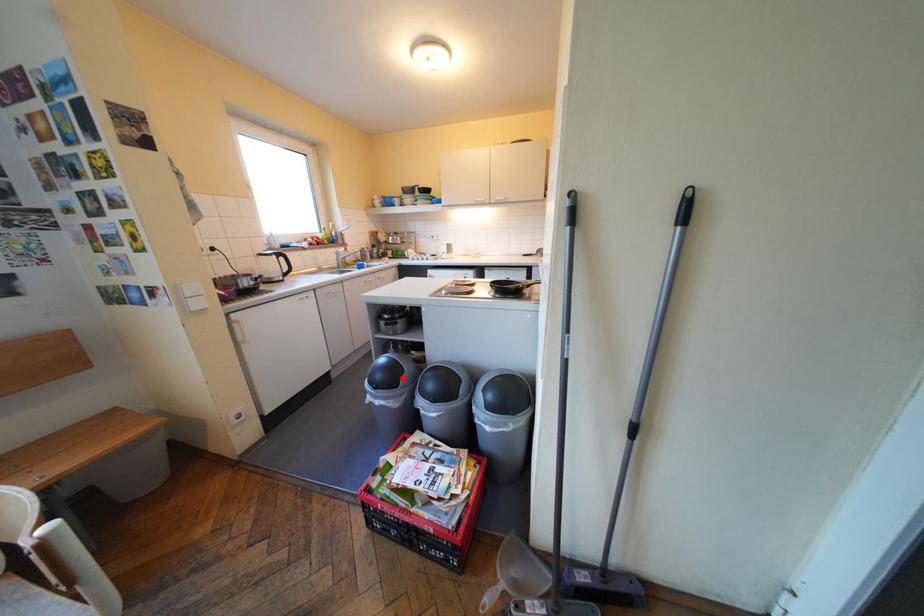
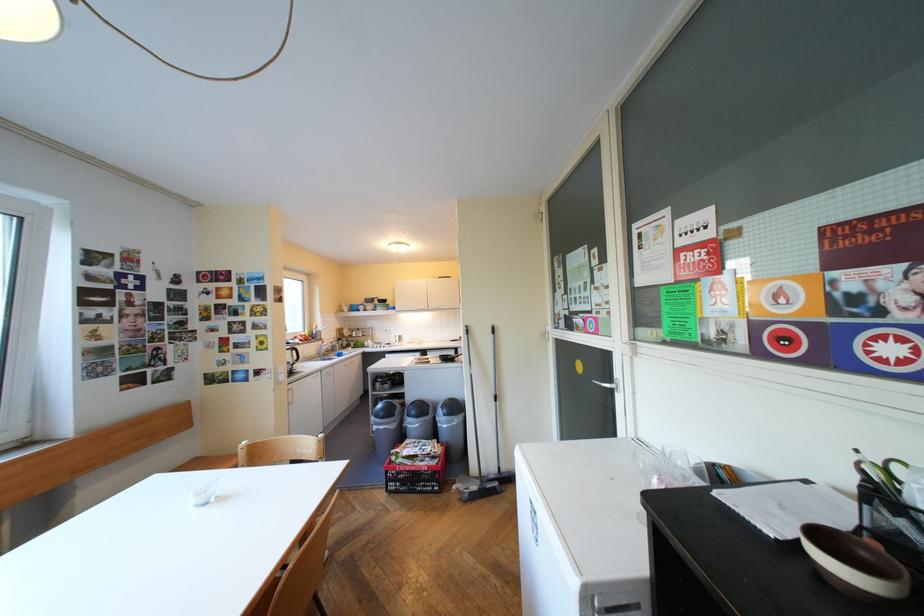
Where in the second image is the point corresponding to the highlighted location from the first image?

(402, 411)